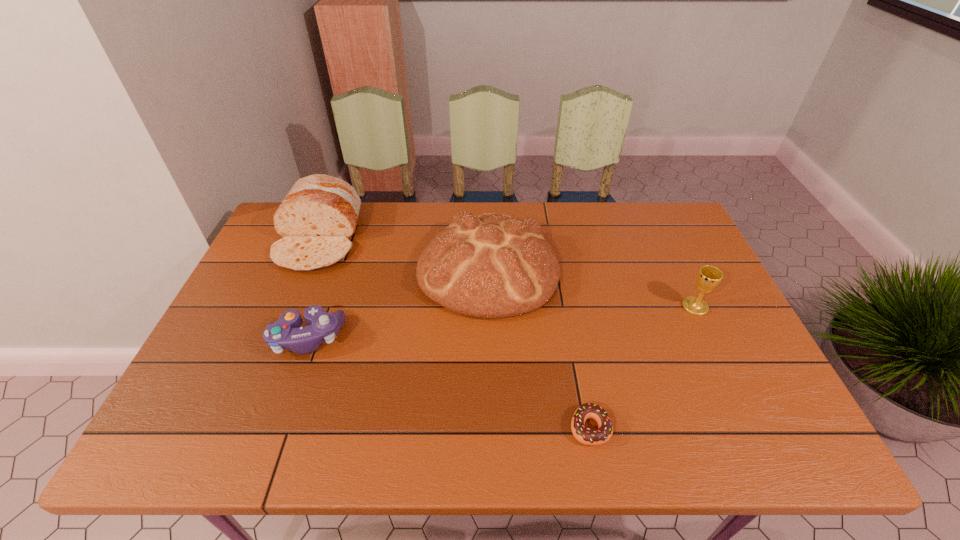
Where is `the left bread`? The width and height of the screenshot is (960, 540). the left bread is located at coordinates (317, 218).

You are a GUI agent. You are given a task and a screenshot of the screen. Output one action in this format:
    pyautogui.click(x=<x>, y=<y>)
    Task: Click on the right bread
    
    Given the screenshot: What is the action you would take?
    pyautogui.click(x=488, y=266)

Locate an element on the screen. This screenshot has height=540, width=960. the third shortest object is located at coordinates (708, 278).

You are a GUI agent. You are given a task and a screenshot of the screen. Output one action in this format:
    pyautogui.click(x=<x>, y=<y>)
    Task: Click on the rightmost object
    This screenshot has height=540, width=960.
    Given the screenshot: What is the action you would take?
    pyautogui.click(x=708, y=278)

You are a GUI agent. You are given a task and a screenshot of the screen. Output one action in this format:
    pyautogui.click(x=<x>, y=<y>)
    Task: Click on the control
    This screenshot has height=540, width=960.
    Given the screenshot: What is the action you would take?
    pyautogui.click(x=285, y=334)

At what (x,y) coordinates should I click in order to perform the action: click on doughnut. Please return your answer as a coordinate pair (x, y). Looking at the image, I should click on (584, 435).

You are a GUI agent. You are given a task and a screenshot of the screen. Output one action in this format:
    pyautogui.click(x=<x>, y=<y>)
    Task: Click on the nearest object
    Image resolution: width=960 pixels, height=540 pixels.
    Given the screenshot: What is the action you would take?
    pyautogui.click(x=584, y=435)

Where is `vacant position located at the sliced end of the left bread`? Image resolution: width=960 pixels, height=540 pixels. vacant position located at the sliced end of the left bread is located at coordinates (273, 350).

You are a GUI agent. You are given a task and a screenshot of the screen. Output one action in this format:
    pyautogui.click(x=<x>, y=<y>)
    Task: Click on the free location located on the right of the right bread
    Image resolution: width=960 pixels, height=540 pixels.
    Given the screenshot: What is the action you would take?
    pyautogui.click(x=588, y=269)

The width and height of the screenshot is (960, 540). What are the coordinates of `free space located 0.140m on the back of the third shortest object` in the screenshot? It's located at [x=675, y=264].